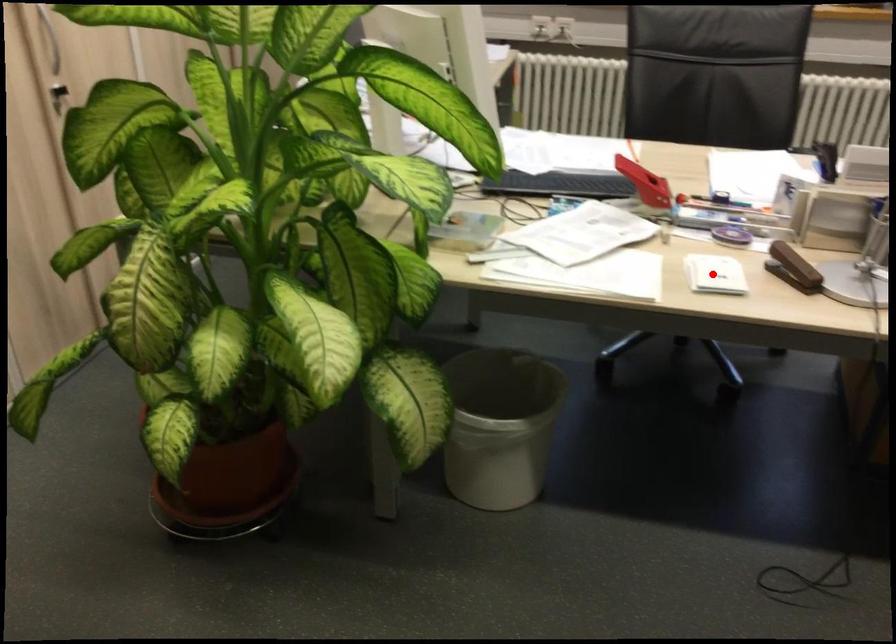
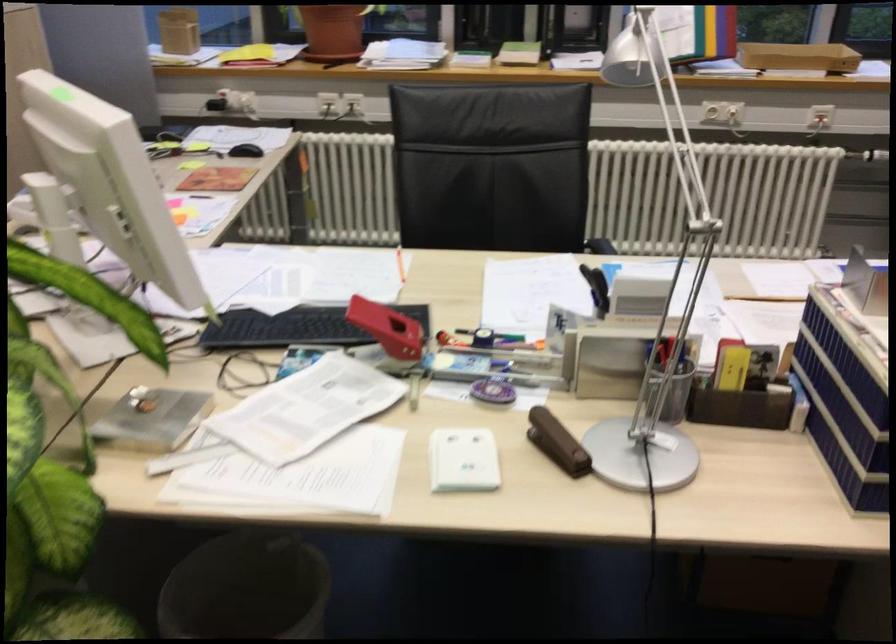
The point at the highlighted location is marked in the first image. Where is the corresponding point in the second image?

(462, 460)